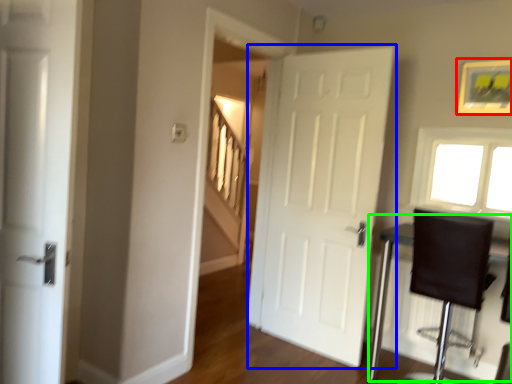
Question: Estimate the real-world distances between objects in this image. Which object is closer to picture frame (highlighted by a red box), door (highlighted by a blue box) or table (highlighted by a green box)?

Choices:
 (A) door
 (B) table

Answer: (A)